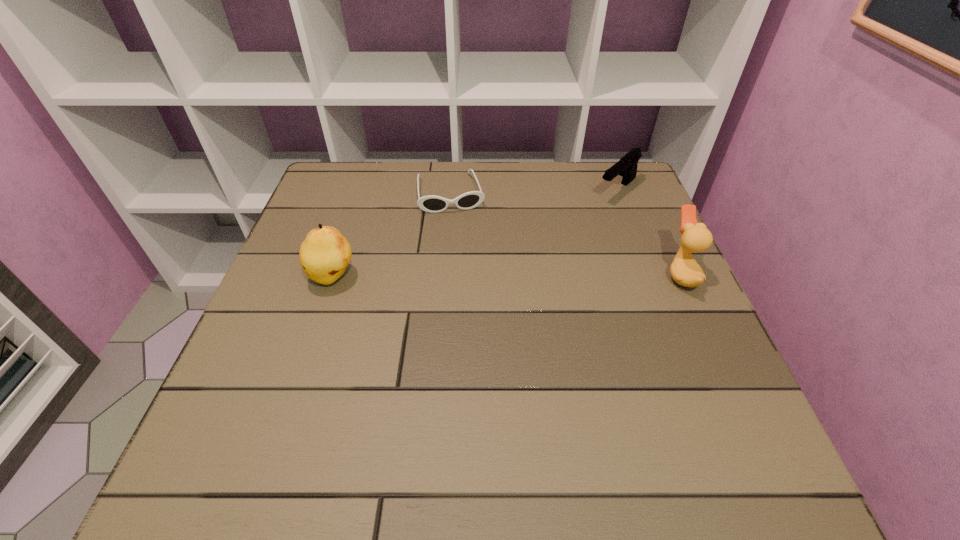
Locate an element on the screen. This screenshot has height=540, width=960. vacant area in the image that satisfies the following two spatial constraints: 1. on the back side of the leftmost object; 2. on the beak of the duck is located at coordinates (334, 274).

The width and height of the screenshot is (960, 540). What are the coordinates of `free location that satisfies the following two spatial constraints: 1. on the back side of the leftmost object; 2. on the beak of the duck` in the screenshot? It's located at (334, 274).

Where is `vacant region that satisfies the following two spatial constraints: 1. on the back side of the duck; 2. on the beak of the leftmost object`? This screenshot has width=960, height=540. vacant region that satisfies the following two spatial constraints: 1. on the back side of the duck; 2. on the beak of the leftmost object is located at coordinates (334, 274).